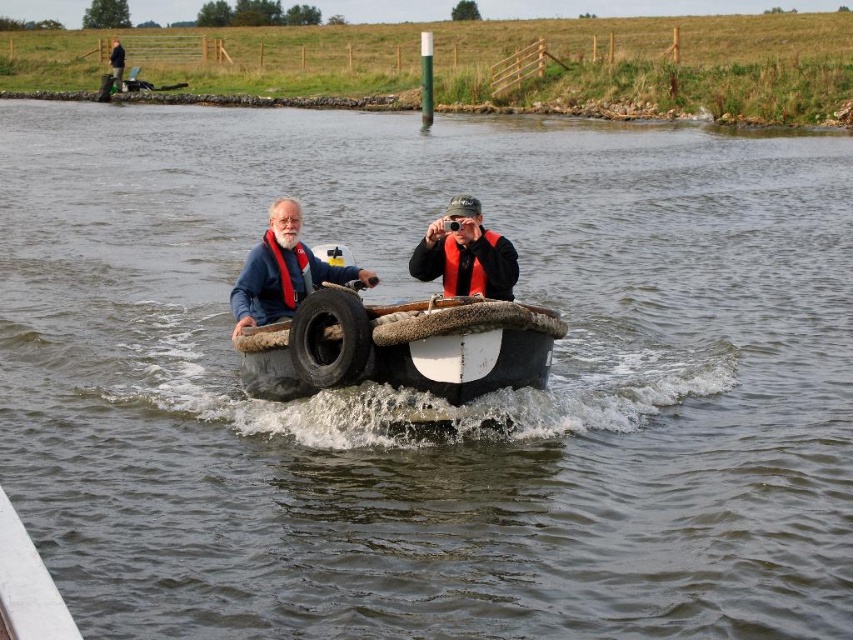
Can you confirm if black rubber tire at center is smaller than red matte life jacket at left?

No.

Is black rubber tire at center taller than red matte life jacket at left?

Correct, black rubber tire at center is much taller as red matte life jacket at left.

Between point (316, 360) and point (305, 266), which one is positioned behind?

The point (305, 266) is behind.

Identify the location of black rubber tire at center. The height and width of the screenshot is (640, 853). click(x=329, y=337).

Is white rubber boat at center closer to the viewer compared to red matte life jacket at left?

Yes, white rubber boat at center is closer to the viewer.

Does white rubber boat at center appear under red matte life jacket at left?

Yes.

Find the location of a particular element. white rubber boat at center is located at coordinates (399, 346).

You are a GUI agent. You are given a task and a screenshot of the screen. Output one action in this format:
    pyautogui.click(x=<x>, y=<y>)
    Task: Click on the white rubber boat at center
    The image size is (853, 640).
    Given the screenshot: What is the action you would take?
    pyautogui.click(x=399, y=346)

Can you confirm if white rubber boat at center is positioned to the left of black rubber tire at center?

No, white rubber boat at center is not to the left of black rubber tire at center.

Is white rubber boat at center smaller than black rubber tire at center?

Indeed, white rubber boat at center has a smaller size compared to black rubber tire at center.

Which is in front, point (483, 378) or point (323, 300)?

Point (323, 300) is more forward.

Where is `white rubber boat at center`? white rubber boat at center is located at coordinates point(399,346).